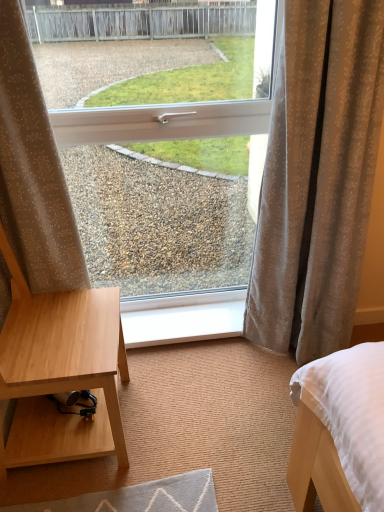
This screenshot has width=384, height=512. I want to click on white plastic window sill at center, so click(183, 318).

What do you see at coordinates (317, 177) in the screenshot?
I see `beige textured curtain at right, acting as the first curtain starting from the right` at bounding box center [317, 177].

Image resolution: width=384 pixels, height=512 pixels. What are the coordinates of `white plastic window sill at center` in the screenshot? It's located at (183, 318).

Measure the distance from white plastic window sill at center to white plastic window at center.

white plastic window sill at center is 17.52 inches away from white plastic window at center.

Is white plastic window sill at center oriented towards white plastic window at center?

No, white plastic window sill at center is not oriented towards white plastic window at center.

Considering the relative sizes of white plastic window sill at center and white plastic window at center in the image provided, is white plastic window sill at center taller than white plastic window at center?

In fact, white plastic window sill at center may be shorter than white plastic window at center.

Is white plastic window sill at center bigger or smaller than white plastic window at center?

white plastic window sill at center is smaller than white plastic window at center.

Looking at this image, in terms of size, does white plastic window sill at center appear bigger or smaller than beige dotted fabric at left, the first curtain when ordered from left to right?

In the image, white plastic window sill at center appears to be smaller than beige dotted fabric at left, the first curtain when ordered from left to right.

Considering the sizes of objects white plastic window sill at center and beige dotted fabric at left, the first curtain when ordered from left to right, in the image provided, who is shorter, white plastic window sill at center or beige dotted fabric at left, the first curtain when ordered from left to right,?

With less height is white plastic window sill at center.

What's the angular difference between white plastic window sill at center and beige dotted fabric at left, which is counted as the 2th curtain, starting from the right,'s facing directions?

The angular difference between white plastic window sill at center and beige dotted fabric at left, which is counted as the 2th curtain, starting from the right, is 2.96 degrees.

From a real-world perspective, does white plastic window at center sit lower than white plastic window sill at center?

No, from a real-world perspective, white plastic window at center is not under white plastic window sill at center.

Is white plastic window at center bigger or smaller than white plastic window sill at center?

Result: Clearly, white plastic window at center is larger in size than white plastic window sill at center.

The image size is (384, 512). Find the location of `window lying in front of the white plastic window sill at center`. window lying in front of the white plastic window sill at center is located at coordinates (342, 180).

From the image's perspective, which one is positioned higher, white plastic window at center or white plastic window sill at center?

white plastic window at center is shown above in the image.

Looking at this image, is beige textured curtain at right, acting as the first curtain starting from the right, aimed at beige dotted fabric at left, the first curtain when ordered from left to right?

No, beige textured curtain at right, acting as the first curtain starting from the right, is not oriented towards beige dotted fabric at left, the first curtain when ordered from left to right.

Does point (285, 124) lie behind point (20, 177)?

Yes, it is.

Consider the image. Measure the distance from beige textured curtain at right, acting as the first curtain starting from the right, to beige dotted fabric at left, the first curtain when ordered from left to right.

The distance of beige textured curtain at right, acting as the first curtain starting from the right, from beige dotted fabric at left, the first curtain when ordered from left to right, is 31.98 inches.

In terms of height, does beige textured curtain at right, which appears as the 2th curtain when viewed from the left, look taller or shorter compared to beige dotted fabric at left, the first curtain when ordered from left to right?

Clearly, beige textured curtain at right, which appears as the 2th curtain when viewed from the left, is taller compared to beige dotted fabric at left, the first curtain when ordered from left to right.

Is white plastic window at center shorter than beige textured curtain at right, acting as the first curtain starting from the right?

Indeed, white plastic window at center has a lesser height compared to beige textured curtain at right, acting as the first curtain starting from the right.

At what (x,y) coordinates should I click in order to perform the action: click on the 2nd curtain below the white plastic window at center (from the image's perspective). Please return your answer as a coordinate pair (x, y). The image size is (384, 512). Looking at the image, I should click on (317, 177).

Is white plastic window at center placed right next to beige textured curtain at right, acting as the first curtain starting from the right?

Yes, white plastic window at center is right next to beige textured curtain at right, acting as the first curtain starting from the right, and making contact.

How different are the orientations of white plastic window at center and beige textured curtain at right, which appears as the 2th curtain when viewed from the left, in degrees?

They differ by 2.83 degrees in their facing directions.

Consider the image. From the image's perspective, which is below, white plastic window sill at center or beige textured curtain at right, which appears as the 2th curtain when viewed from the left?

white plastic window sill at center is shown below in the image.

Looking at this image, considering the sizes of objects white plastic window sill at center and beige textured curtain at right, acting as the first curtain starting from the right, in the image provided, who is smaller, white plastic window sill at center or beige textured curtain at right, acting as the first curtain starting from the right,?

white plastic window sill at center is smaller.

What's the angular difference between white plastic window sill at center and beige textured curtain at right, acting as the first curtain starting from the right,'s facing directions?

2.96 degrees.

Considering the relative positions of beige dotted fabric at left, the first curtain when ordered from left to right, and beige textured curtain at right, which appears as the 2th curtain when viewed from the left, in the image provided, is beige dotted fabric at left, the first curtain when ordered from left to right, behind beige textured curtain at right, which appears as the 2th curtain when viewed from the left,?

No, beige dotted fabric at left, the first curtain when ordered from left to right, is closer to the viewer.

Does beige dotted fabric at left, which is counted as the 2th curtain, starting from the right, have a lesser height compared to beige textured curtain at right, acting as the first curtain starting from the right?

Yes, beige dotted fabric at left, which is counted as the 2th curtain, starting from the right, is shorter than beige textured curtain at right, acting as the first curtain starting from the right.

Would you consider beige dotted fabric at left, which is counted as the 2th curtain, starting from the right, to be distant from beige textured curtain at right, which appears as the 2th curtain when viewed from the left?

No, beige dotted fabric at left, which is counted as the 2th curtain, starting from the right, is not far from beige textured curtain at right, which appears as the 2th curtain when viewed from the left.

Is beige dotted fabric at left, which is counted as the 2th curtain, starting from the right, positioned with its back to beige textured curtain at right, which appears as the 2th curtain when viewed from the left?

No, beige dotted fabric at left, which is counted as the 2th curtain, starting from the right, is not facing away from beige textured curtain at right, which appears as the 2th curtain when viewed from the left.

At what (x,y) coordinates should I click in order to perform the action: click on window sill behind the white plastic window at center. Please return your answer as a coordinate pair (x, y). The width and height of the screenshot is (384, 512). Looking at the image, I should click on (183, 318).

What are the coordinates of `curtain that is the 2nd one when counting forward from the white plastic window sill at center` in the screenshot? It's located at (33, 170).

Considering their positions, is beige dotted fabric at left, which is counted as the 2th curtain, starting from the right, positioned closer to beige textured curtain at right, acting as the first curtain starting from the right, than white plastic window sill at center?

white plastic window sill at center.

Considering their positions, is white plastic window at center positioned closer to white plastic window sill at center than beige textured curtain at right, which appears as the 2th curtain when viewed from the left?

The object closer to white plastic window sill at center is white plastic window at center.

Consider the image. Looking at the image, which one is located further to white plastic window at center, beige textured curtain at right, acting as the first curtain starting from the right, or white plastic window sill at center?

The object further to white plastic window at center is white plastic window sill at center.

Which object lies further to the anchor point beige dotted fabric at left, the first curtain when ordered from left to right, white plastic window at center or beige textured curtain at right, acting as the first curtain starting from the right?

The object further to beige dotted fabric at left, the first curtain when ordered from left to right, is white plastic window at center.

Estimate the real-world distances between objects in this image. Which object is further from beige dotted fabric at left, the first curtain when ordered from left to right, white plastic window sill at center or white plastic window at center?

white plastic window at center.

From the image, which object appears to be nearer to white plastic window at center, white plastic window sill at center or beige dotted fabric at left, the first curtain when ordered from left to right?

The object closer to white plastic window at center is white plastic window sill at center.

Based on their spatial positions, is white plastic window at center or white plastic window sill at center closer to beige textured curtain at right, acting as the first curtain starting from the right?

white plastic window at center is positioned closer to the anchor beige textured curtain at right, acting as the first curtain starting from the right.

Considering their positions, is beige dotted fabric at left, which is counted as the 2th curtain, starting from the right, positioned further to white plastic window sill at center than white plastic window at center?

Based on the image, beige dotted fabric at left, which is counted as the 2th curtain, starting from the right, appears to be further to white plastic window sill at center.

Locate an element on the screen. window located between beige dotted fabric at left, which is counted as the 2th curtain, starting from the right, and beige textured curtain at right, which appears as the 2th curtain when viewed from the left, in the left-right direction is located at coordinates (342, 180).

You are a GUI agent. You are given a task and a screenshot of the screen. Output one action in this format:
    pyautogui.click(x=<x>, y=<y>)
    Task: Click on the window sill situated between beige dotted fabric at left, the first curtain when ordered from left to right, and beige textured curtain at right, acting as the first curtain starting from the right, from left to right
    The width and height of the screenshot is (384, 512).
    Given the screenshot: What is the action you would take?
    pyautogui.click(x=183, y=318)

This screenshot has height=512, width=384. Identify the location of window between beige textured curtain at right, which appears as the 2th curtain when viewed from the left, and white plastic window sill at center in the front-back direction. (342, 180).

You are a GUI agent. You are given a task and a screenshot of the screen. Output one action in this format:
    pyautogui.click(x=<x>, y=<y>)
    Task: Click on the window between beige dotted fabric at left, the first curtain when ordered from left to right, and white plastic window sill at center in the front-back direction
    This screenshot has width=384, height=512.
    Given the screenshot: What is the action you would take?
    pyautogui.click(x=342, y=180)